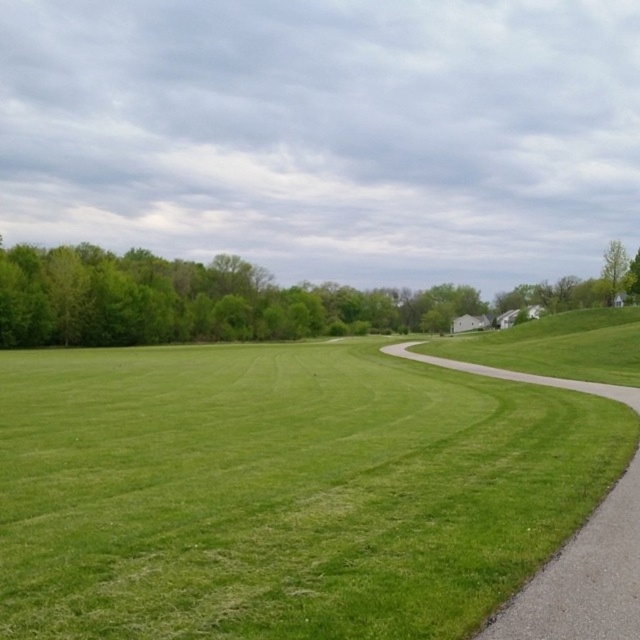
The image size is (640, 640). Describe the element at coordinates (193, 300) in the screenshot. I see `green leafy tree at left` at that location.

Is green leafy tree at left shorter than gravel path at right?

In fact, green leafy tree at left may be taller than gravel path at right.

Is point (243, 285) behind point (602, 554)?

Yes, point (243, 285) is behind point (602, 554).

The width and height of the screenshot is (640, 640). Identify the location of green leafy tree at left. (193, 300).